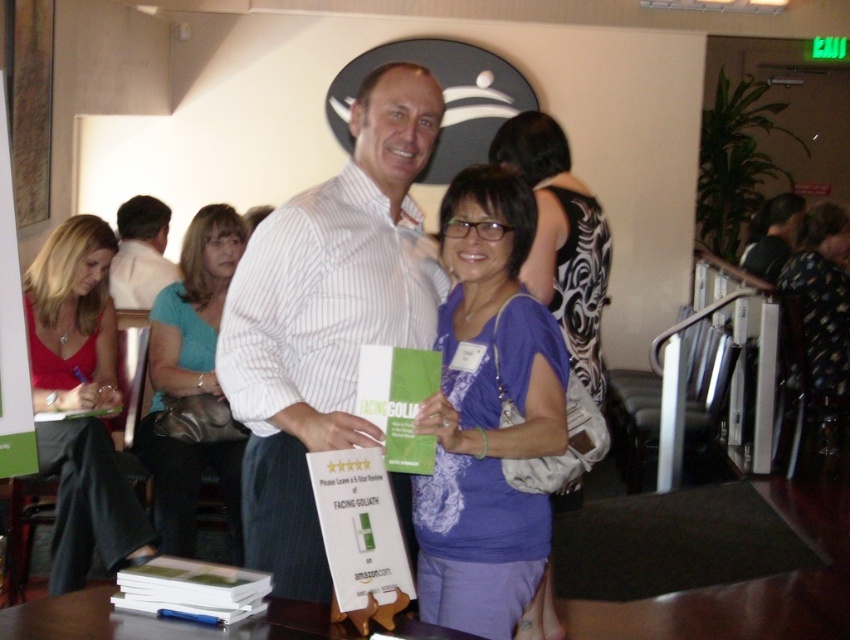
Question: Which object appears farthest from the camera in this image?

Choices:
 (A) wooden table at lower center
 (B) white striped shirt at center
 (C) dark gray shirt at center

Answer: (C)

Question: Does teal fabric purse at center lie in front of purple fabric shirt at center?

Choices:
 (A) yes
 (B) no

Answer: (B)

Question: From the image, what is the correct spatial relationship of black dotted dress at center in relation to dark gray shirt at center?

Choices:
 (A) right
 (B) left

Answer: (B)

Question: Is teal fabric purse at center closer to the viewer compared to white shirt at left?

Choices:
 (A) no
 (B) yes

Answer: (B)

Question: Among these objects, which one is farthest from the camera?

Choices:
 (A) matte red blouse at left
 (B) dark gray shirt at center

Answer: (B)

Question: Among these objects, which one is nearest to the camera?

Choices:
 (A) purple cotton shirt at center
 (B) dark gray shirt at center
 (C) white shirt at left
 (D) purple fabric shirt at center

Answer: (A)